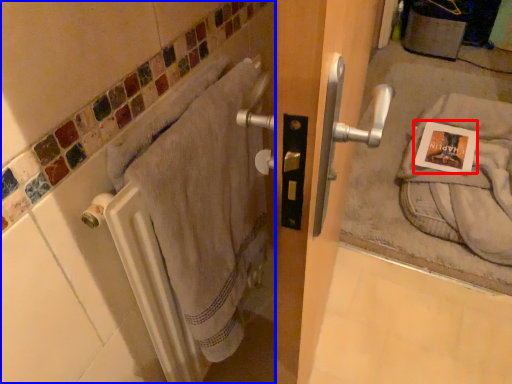
Question: Which point is closer to the camera, postcard (highlighted by a red box) or bath (highlighted by a blue box)?

Choices:
 (A) postcard
 (B) bath

Answer: (B)